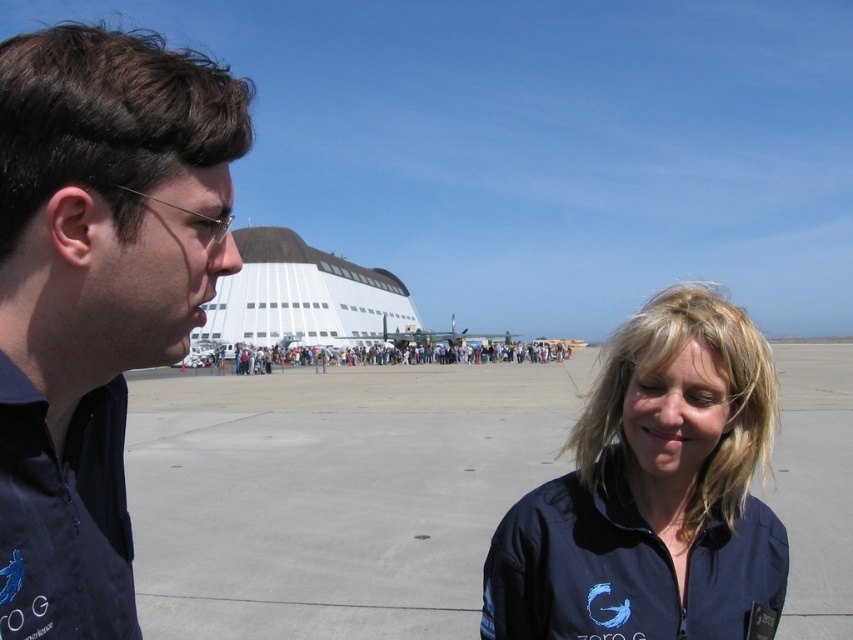
Is dark gray asphalt at center shorter than dark blue fabric couple at center?

In fact, dark gray asphalt at center may be taller than dark blue fabric couple at center.

Is dark gray asphalt at center to the left of dark blue fabric couple at center from the viewer's perspective?

In fact, dark gray asphalt at center is to the right of dark blue fabric couple at center.

Which is behind, point (157, 490) or point (341, 362)?

Point (341, 362)

Locate an element on the screen. dark gray asphalt at center is located at coordinates (334, 493).

Can you confirm if blue fabric jacket at center is positioned to the left of dark blue fabric couple at center?

No, blue fabric jacket at center is not to the left of dark blue fabric couple at center.

Who is lower down, blue fabric jacket at center or dark blue fabric couple at center?

blue fabric jacket at center

Is point (720, 512) positioned in front of point (439, 356)?

Yes, it is.

Where is `blue fabric jacket at center`? blue fabric jacket at center is located at coordinates (653, 492).

Who is more distant from viewer, [183,420] or [508,579]?

Point [183,420]

Is dark gray asphalt at center positioned behind blue fabric jacket at center?

Yes, it is.

Which is behind, point (825, 630) or point (612, 342)?

The point (825, 630) is behind.

The image size is (853, 640). What are the coordinates of `dark gray asphalt at center` in the screenshot? It's located at pyautogui.click(x=334, y=493).